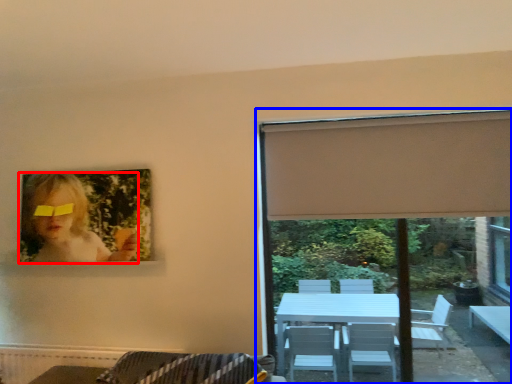
Question: Which of the following is the closest to the observer, woman (highlighted by a red box) or window (highlighted by a blue box)?

Choices:
 (A) woman
 (B) window

Answer: (B)